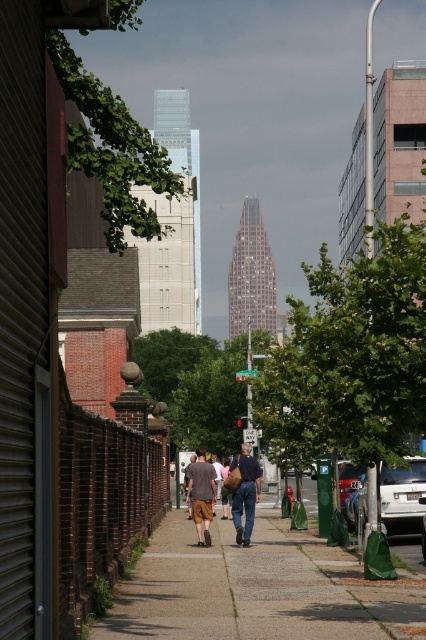
Question: Which point is farther from the camera taking this photo?

Choices:
 (A) (236, 538)
 (B) (239, 529)
 (C) (204, 470)

Answer: (A)

Question: Does white matte van at center have a lesser width compared to denim jeans at center?

Choices:
 (A) yes
 (B) no

Answer: (B)

Question: Does gray concrete sidewalk at center appear on the left side of white matte van at center?

Choices:
 (A) yes
 (B) no

Answer: (A)

Question: Among these points, which one is nearest to the camera?

Choices:
 (A) (212, 467)
 (B) (385, 531)
 (C) (154, 598)

Answer: (C)

Question: Does white matte van at center lie behind brown canvas bag at center?

Choices:
 (A) no
 (B) yes

Answer: (B)

Question: Which point is closer to the camera?

Choices:
 (A) (396, 497)
 (B) (360, 474)

Answer: (A)